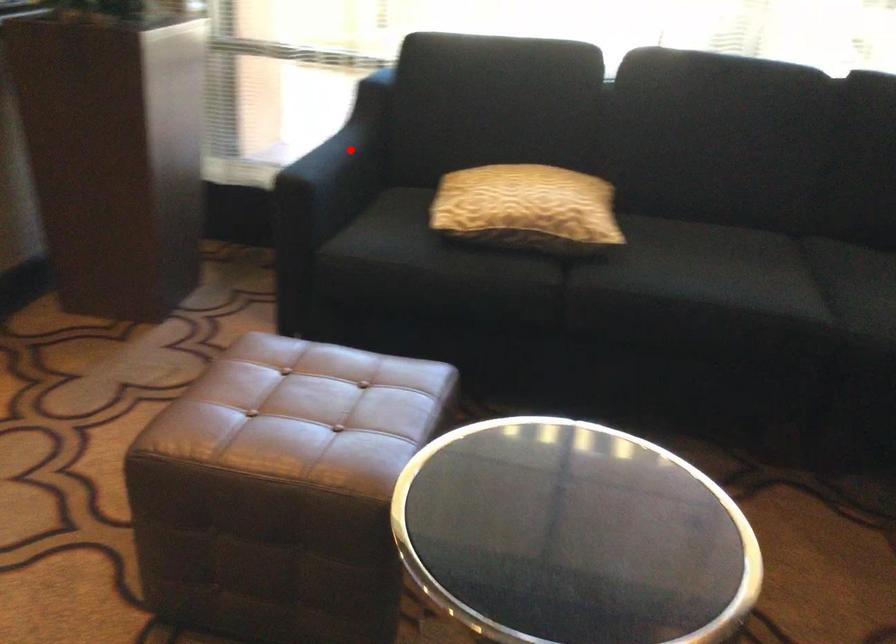
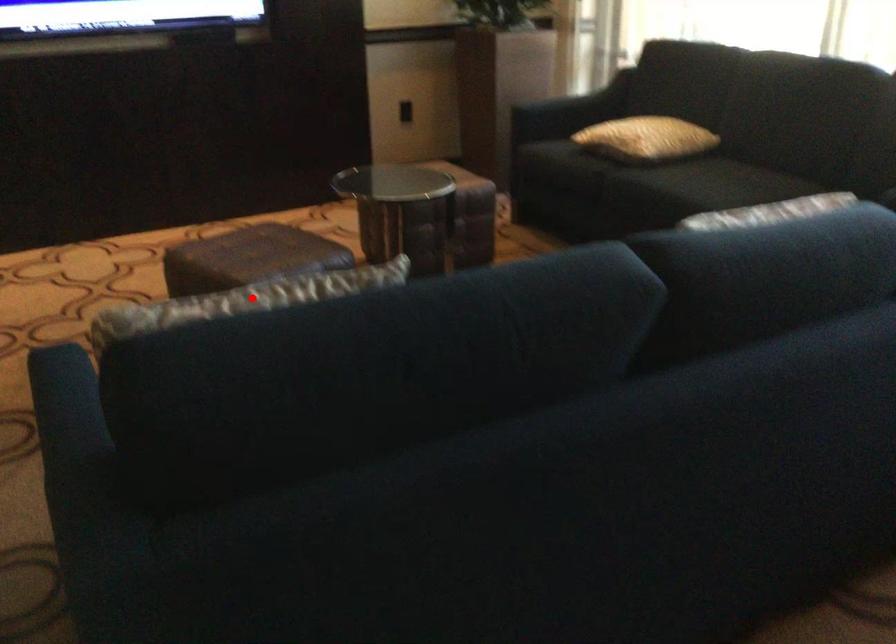
I am providing you with two images of the same scene from different viewpoints. A red point is marked on the first image and another point is marked on the second image. Are the points marked in image1 and image2 representing the same 3D position?

No